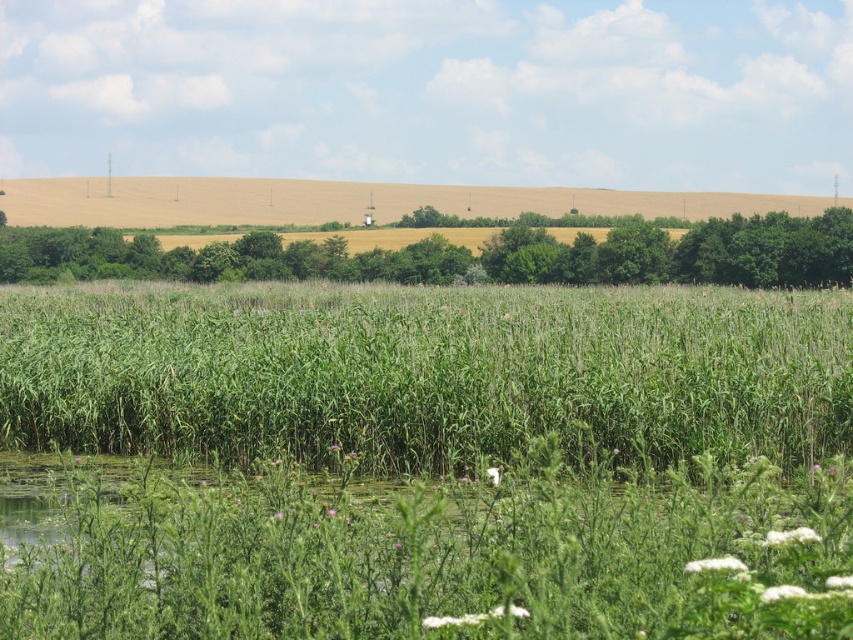
Question: Does green grassy at center have a larger size compared to green leafy tree at center?

Choices:
 (A) yes
 (B) no

Answer: (A)

Question: Does green grassy at center have a smaller size compared to green leafy tree at center?

Choices:
 (A) no
 (B) yes

Answer: (A)

Question: Which object appears closest to the camera in this image?

Choices:
 (A) green grassy at center
 (B) green leafy tree at center

Answer: (A)

Question: Which point is closer to the camera taking this photo?

Choices:
 (A) (700, 228)
 (B) (648, 291)

Answer: (B)

Question: Is the position of green grassy at center less distant than that of green leafy tree at center?

Choices:
 (A) yes
 (B) no

Answer: (A)